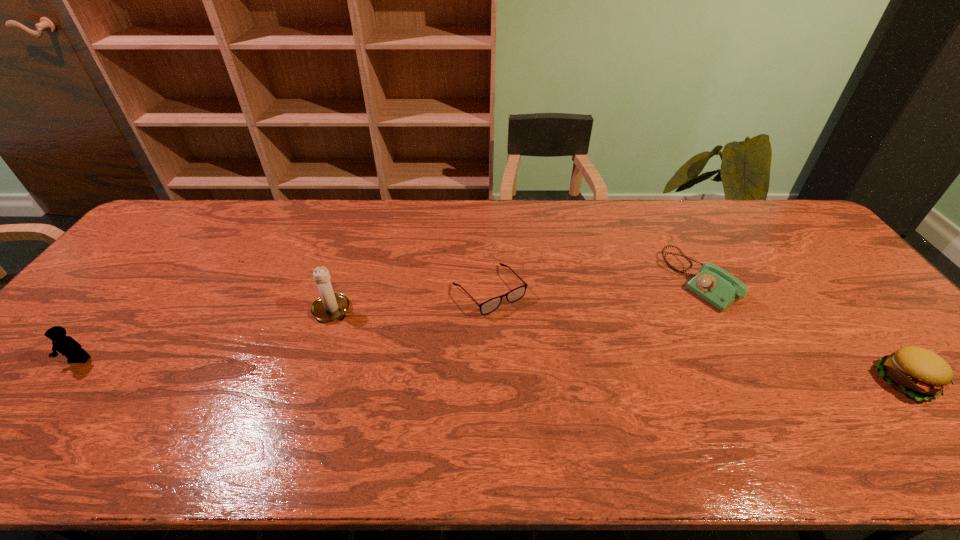
This screenshot has width=960, height=540. I want to click on free location that satisfies the following two spatial constraints: 1. on the front-facing side of the rightmost object; 2. on the left side of the Lego, so pos(62,381).

Find the location of a particular element. The image size is (960, 540). free location that satisfies the following two spatial constraints: 1. on the back side of the second object from left to right; 2. on the left side of the fourth tallest object is located at coordinates (343, 281).

Image resolution: width=960 pixels, height=540 pixels. Identify the location of vacant area that satisfies the following two spatial constraints: 1. on the front side of the hamburger; 2. on the left side of the spectacles. (491, 381).